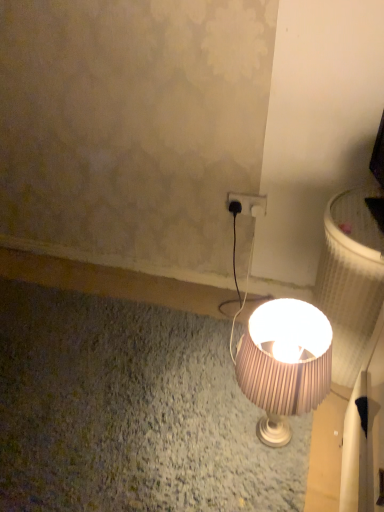
Question: From a real-world perspective, is matte brown lampshade at center positioned over black plastic plug at center based on gravity?

Choices:
 (A) no
 (B) yes

Answer: (A)

Question: Is matte brown lampshade at center located outside black plastic plug at center?

Choices:
 (A) no
 (B) yes

Answer: (B)

Question: Does matte brown lampshade at center have a smaller size compared to black plastic plug at center?

Choices:
 (A) yes
 (B) no

Answer: (B)

Question: From a real-world perspective, is matte brown lampshade at center under black plastic plug at center?

Choices:
 (A) no
 (B) yes

Answer: (B)

Question: Is matte brown lampshade at center at the right side of black plastic plug at center?

Choices:
 (A) no
 (B) yes

Answer: (B)

Question: In the image, is matte brown lampshade at center positioned in front of or behind black plastic power plug at upper right?

Choices:
 (A) behind
 (B) front

Answer: (B)

Question: In terms of height, does matte brown lampshade at center look taller or shorter compared to black plastic power plug at upper right?

Choices:
 (A) tall
 (B) short

Answer: (A)

Question: From a real-world perspective, is matte brown lampshade at center above or below black plastic power plug at upper right?

Choices:
 (A) above
 (B) below

Answer: (B)

Question: Considering the positions of matte brown lampshade at center and black plastic power plug at upper right in the image, is matte brown lampshade at center wider or thinner than black plastic power plug at upper right?

Choices:
 (A) thin
 (B) wide

Answer: (B)

Question: From a real-world perspective, relative to black plastic plug at center, is black plastic power plug at upper right vertically above or below?

Choices:
 (A) above
 (B) below

Answer: (A)

Question: Looking at the image, does black plastic power plug at upper right seem bigger or smaller compared to black plastic plug at center?

Choices:
 (A) big
 (B) small

Answer: (A)

Question: In the image, is black plastic power plug at upper right positioned in front of or behind black plastic plug at center?

Choices:
 (A) behind
 (B) front

Answer: (B)

Question: From the image's perspective, is black plastic power plug at upper right above or below black plastic plug at center?

Choices:
 (A) above
 (B) below

Answer: (A)

Question: Relative to matte brown lampshade at center, is black plastic plug at center in front or behind?

Choices:
 (A) front
 (B) behind

Answer: (B)

Question: Is black plastic plug at center to the left or to the right of matte brown lampshade at center in the image?

Choices:
 (A) left
 (B) right

Answer: (A)